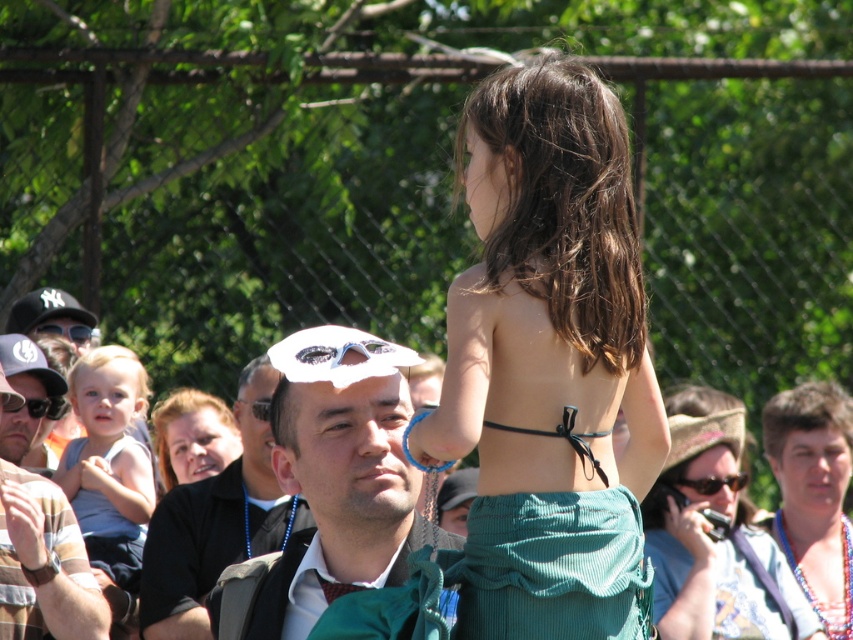
In the scene shown: You are a photographer at the event and want to capture a clear shot of both the white matte goggles at center and the matte black sunglasses at upper left. Which object should you focus on first if you want to ensure both are in focus?

The white matte goggles at center should be focused on first since it is positioned to the right of the matte black sunglasses at upper left, allowing both to be in focus when using a camera with a focus stacking technique.

Based on the photo, you are a photographer at the event and want to capture a photo where the light blue sleeveless shirt at left and the blonde hair at center are both visible. Based on their heights, which object should be placed closer to the camera to ensure both are in frame?

The light blue sleeveless shirt at left is taller than the blonde hair at center, so to ensure both are visible in the photo, the blonde hair at center should be placed closer to the camera. This way, the shorter object will be more prominent and both can be captured within the frame.